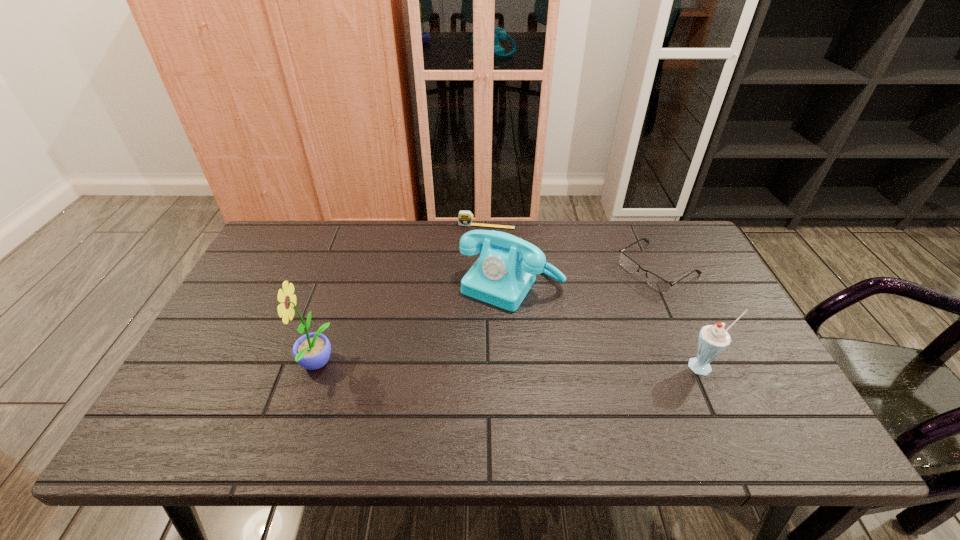
Where is `spectacles at the far edge`? This screenshot has height=540, width=960. spectacles at the far edge is located at coordinates (656, 282).

Identify the location of tape measure located at the far edge. Image resolution: width=960 pixels, height=540 pixels. (465, 218).

Find the location of a particular element. The width and height of the screenshot is (960, 540). sunflower that is at the near edge is located at coordinates (312, 351).

Identify the location of milkshake present at the near edge. This screenshot has width=960, height=540. (713, 339).

Locate an element on the screen. The height and width of the screenshot is (540, 960). milkshake at the right edge is located at coordinates (713, 339).

At what (x,y) coordinates should I click in order to perform the action: click on spectacles that is at the right edge. Please return your answer as a coordinate pair (x, y). Looking at the image, I should click on (656, 282).

Identify the location of object that is at the far right corner. (656, 282).

Find the location of a particular element. object that is at the near right corner is located at coordinates (713, 339).

Where is `free region at the far edge`? The height and width of the screenshot is (540, 960). free region at the far edge is located at coordinates (545, 233).

At what (x,y) coordinates should I click in order to perform the action: click on free region at the near edge of the desktop. Please return your answer as a coordinate pair (x, y). Looking at the image, I should click on (636, 408).